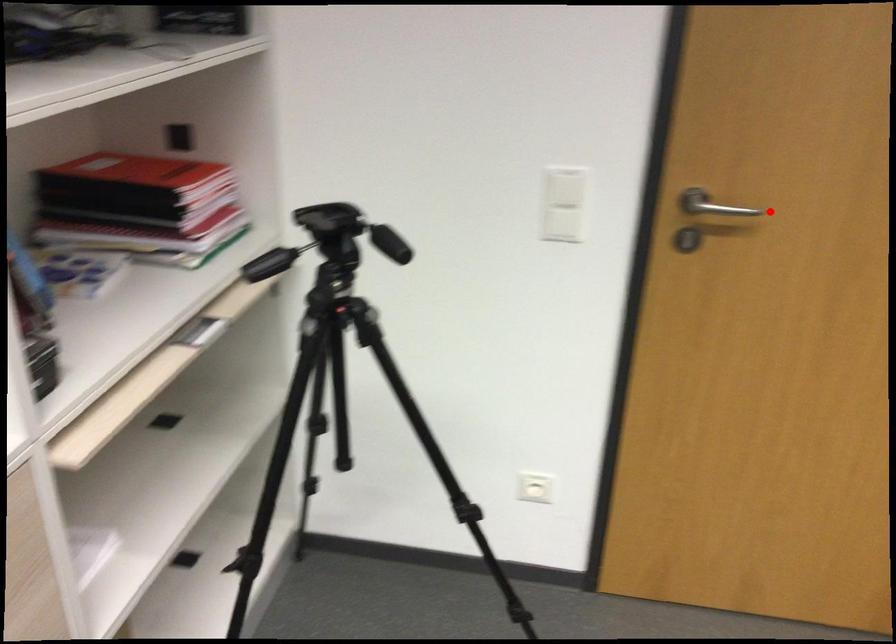
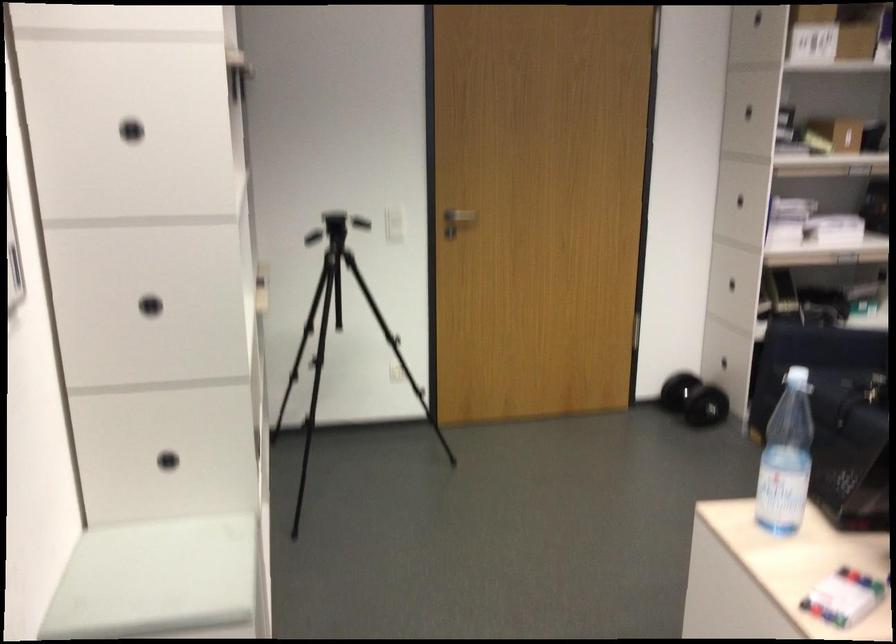
Question: I am providing you with two images of the same scene from different viewpoints. A red point is marked on the first image. Is the red point's position out of view in image 2?

Choices:
 (A) Yes
 (B) No

Answer: (B)